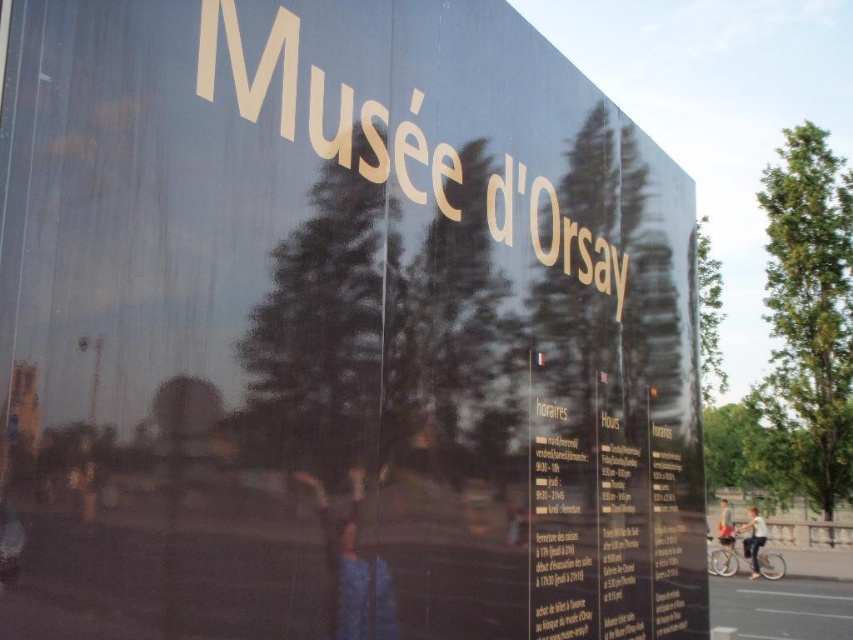
Which is above, light blue jeans at lower right or light brown leather jacket at lower right?

light blue jeans at lower right

Where is `light blue jeans at lower right`? Image resolution: width=853 pixels, height=640 pixels. light blue jeans at lower right is located at coordinates tap(753, 540).

You are a GUI agent. You are given a task and a screenshot of the screen. Output one action in this format:
    pyautogui.click(x=<x>, y=<y>)
    Task: Click on the light blue jeans at lower right
    
    Given the screenshot: What is the action you would take?
    pyautogui.click(x=753, y=540)

Where is `light blue jeans at lower right`? Image resolution: width=853 pixels, height=640 pixels. light blue jeans at lower right is located at coordinates (753, 540).